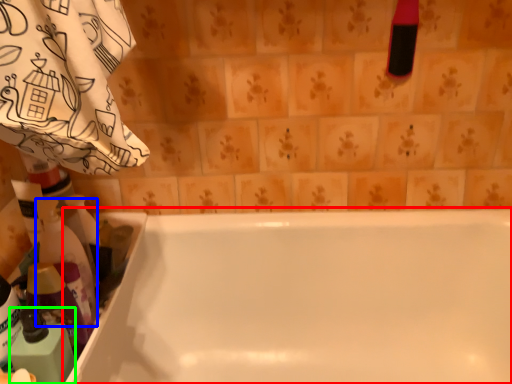
Question: Which object is the farthest from bathtub (highlighted by a red box)? Choose among these: cleaning product (highlighted by a blue box) or cleaning product (highlighted by a green box).

Choices:
 (A) cleaning product
 (B) cleaning product

Answer: (B)